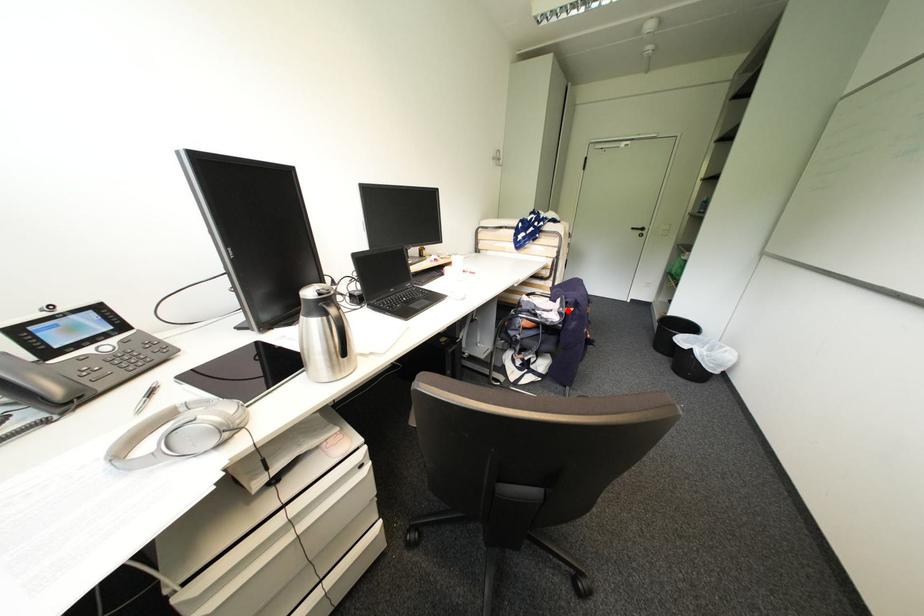
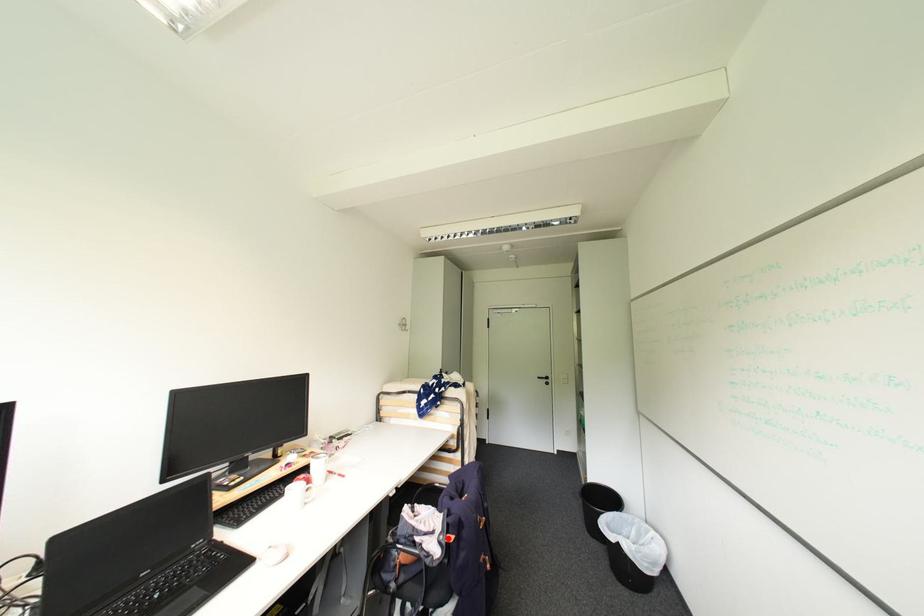
I am providing you with two images of the same scene from different viewpoints. A red point is marked on the first image and another point is marked on the second image. Is the marked point in image1 the same physical position as the marked point in image2?

Yes